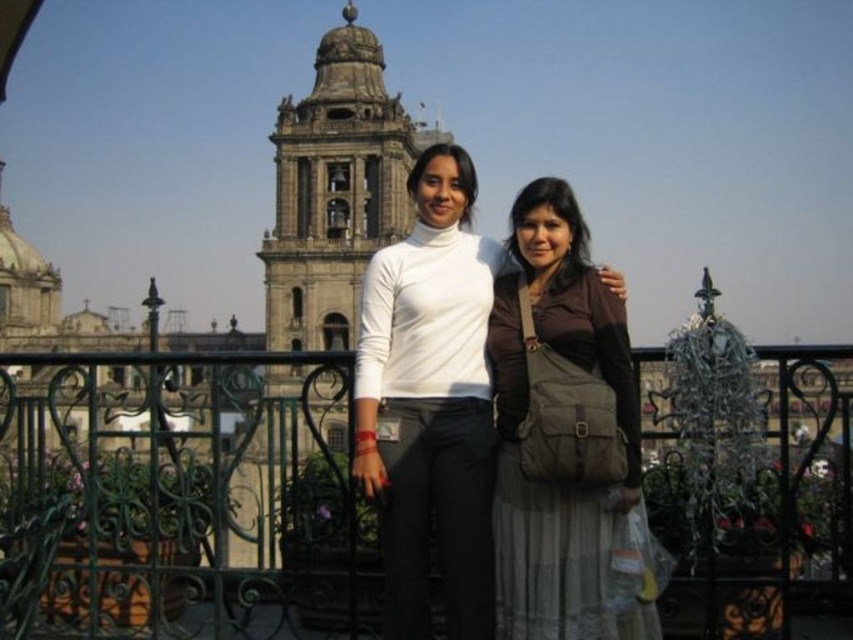
You are a photographer trying to capture the matte brown bag at center in your shot. The camera you are using has a focal length of 50mm and you are standing at point 0.5, 0.5. Can you estimate if the bag will be in the frame?

The matte brown bag at center is located at point (566, 440), which is outside the camera frame centered at (426, 320) with a 50mm focal length. Therefore, the bag will not be in the frame.

You are a photographer trying to capture a clear shot of the matte brown bag at center and the matte brown dress at center. Since you want both subjects to be visible, which one should you focus on to ensure the smaller object is in frame?

The matte brown bag at center occupies less space than the matte brown dress at center, so you should focus on the matte brown bag at center to ensure the smaller object is in frame.